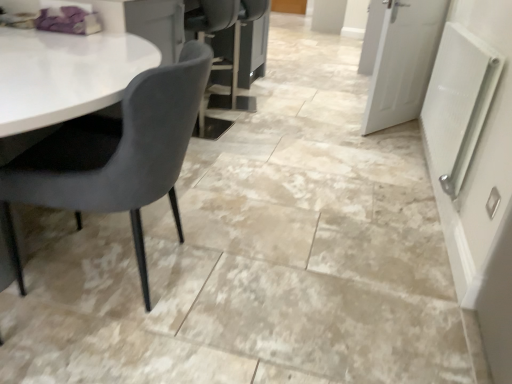
Question: Does point (437, 119) appear closer or farther from the camera than point (139, 223)?

Choices:
 (A) closer
 (B) farther

Answer: (B)

Question: Is white textured radiator at right bigger or smaller than velvet grey chair at left?

Choices:
 (A) big
 (B) small

Answer: (B)

Question: Considering the real-world distances, which object is farthest from the white matte door at upper right, which ranks as the first door in bottom-to-top order?

Choices:
 (A) white textured radiator at right
 (B) white painted wood door at upper right, the second door from the bottom
 (C) velvet grey chair at left

Answer: (C)

Question: Estimate the real-world distances between objects in this image. Which object is closer to the velvet grey chair at left?

Choices:
 (A) white textured radiator at right
 (B) white matte door at upper right, which ranks as the first door in bottom-to-top order
 (C) white painted wood door at upper right, which is the second door in front-to-back order

Answer: (A)